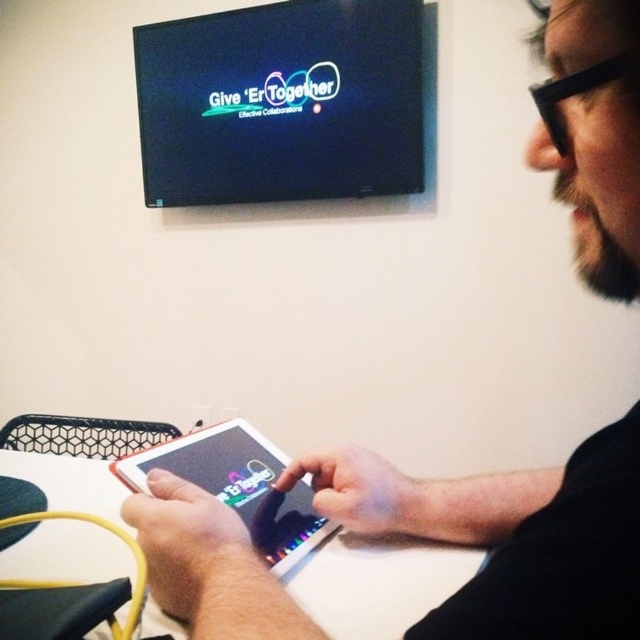
You are a delivery robot with a package that needs to be placed on the white glossy table at center. The robot is 18 inches wide. Can you approach the table and place the package without any obstruction?

The distance between the white glossy table at center and the viewer is 20.43 inches. Since the robot is 18 inches wide, it can approach the table and place the package as the distance allows sufficient space for the robot to maneuver.

You are a delivery person who needs to place a small package on the table. According to the coordinates provided, where exactly should you place the package on the white glossy table at center?

The white glossy table at center is located at point coordinates (378, 582), so place the package there.

You are a photographer setting up a shoot in this room. You need to place a small lamp on the table so that it doesn not block the tablet. Where should you place the lamp on the white glossy table at center relative to the matte black tablet at center?

The white glossy table at center is positioned under the matte black tablet at center, so placing the lamp on the table away from the tablet would ensure it does not block it. Since the tablet is at the center, placing the lamp towards the edge of the table would be ideal.